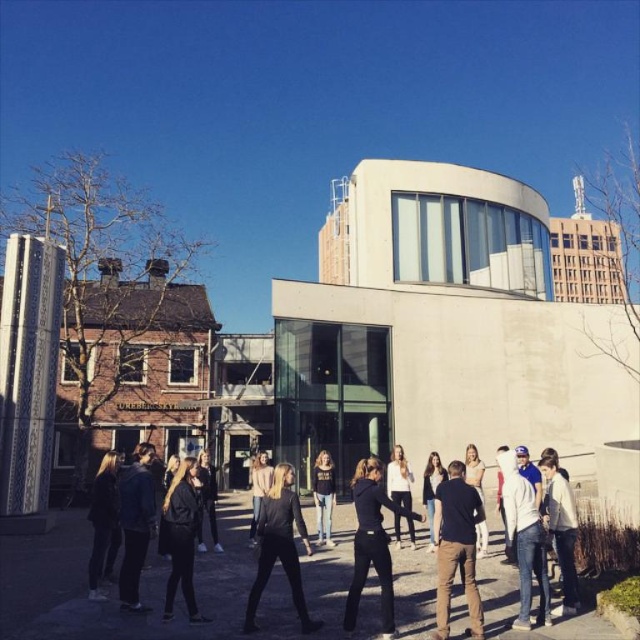
Question: Which of the following is the farthest from the observer?

Choices:
 (A) (396, 481)
 (B) (451, 468)
 (C) (276, 504)

Answer: (A)

Question: Is the position of black matte pants at center less distant than that of denim pants at center?

Choices:
 (A) yes
 (B) no

Answer: (A)

Question: Which of the following is the closest to the observer?

Choices:
 (A) white matte shirt at center
 (B) black matte pants at center

Answer: (B)

Question: Can you confirm if black matte jacket at center is wider than denim pants at center?

Choices:
 (A) yes
 (B) no

Answer: (A)

Question: Which object is farther from the camera taking this photo?

Choices:
 (A) denim pants at center
 (B) black matte pants at center
 (C) white matte shirt at center
 (D) black matte shirt at center

Answer: (A)

Question: Observing the image, what is the correct spatial positioning of black matte pants at center in reference to black matte jacket at center?

Choices:
 (A) below
 (B) above

Answer: (A)